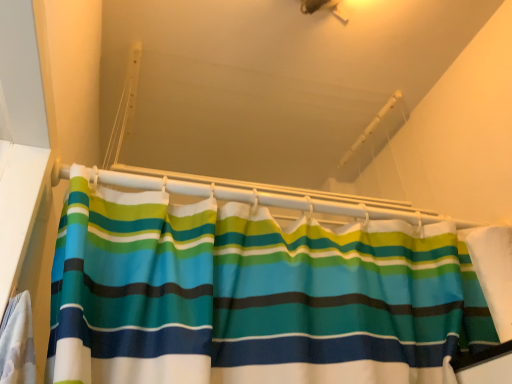
Question: From their relative heights in the image, would you say white plastic shower curtain rod at upper center is taller or shorter than white fabric at right?

Choices:
 (A) tall
 (B) short

Answer: (B)

Question: Based on their positions, is white plastic shower curtain rod at upper center located to the left or right of white fabric at right?

Choices:
 (A) left
 (B) right

Answer: (A)

Question: From the image's perspective, is white plastic shower curtain rod at upper center positioned above or below white fabric at right?

Choices:
 (A) above
 (B) below

Answer: (A)

Question: Choose the correct answer: Is white fabric at right inside white plastic shower curtain rod at upper center or outside it?

Choices:
 (A) inside
 (B) outside

Answer: (B)

Question: Is white fabric at right wider or thinner than white plastic shower curtain rod at upper center?

Choices:
 (A) wide
 (B) thin

Answer: (A)

Question: Is white fabric at right to the left or to the right of white plastic shower curtain rod at upper center in the image?

Choices:
 (A) right
 (B) left

Answer: (A)

Question: Is white fabric at right in front of or behind white plastic shower curtain rod at upper center in the image?

Choices:
 (A) behind
 (B) front

Answer: (B)